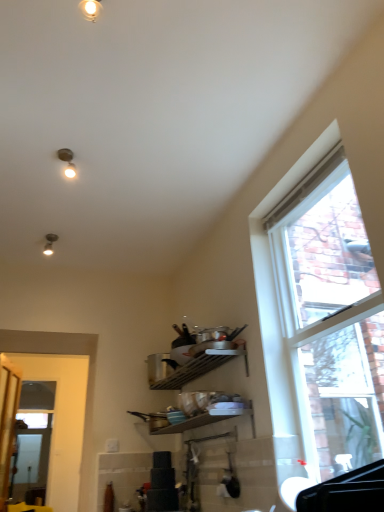
Question: Is matte silver light fixture at upper left, the 2th light fixture positioned from the right, not within white glossy door at left?

Choices:
 (A) no
 (B) yes

Answer: (B)

Question: Considering the relative sizes of matte silver light fixture at upper left, which is the second light fixture from front to back, and white glossy door at left in the image provided, is matte silver light fixture at upper left, which is the second light fixture from front to back, taller than white glossy door at left?

Choices:
 (A) no
 (B) yes

Answer: (A)

Question: Are matte silver light fixture at upper left, which ranks as the 1th light fixture in left-to-right order, and white glossy door at left far apart?

Choices:
 (A) yes
 (B) no

Answer: (A)

Question: Is matte silver light fixture at upper left, the 2th light fixture positioned from the right, to the right of white glossy door at left from the viewer's perspective?

Choices:
 (A) yes
 (B) no

Answer: (A)

Question: From the image's perspective, is matte silver light fixture at upper left, which is counted as the 2th light fixture, starting from the top, located above white glossy door at left?

Choices:
 (A) no
 (B) yes

Answer: (B)

Question: From a real-world perspective, is clear glass screen door at left physically located above or below matte white light fixture at upper center, which ranks as the 2th light fixture in left-to-right order?

Choices:
 (A) below
 (B) above

Answer: (A)

Question: In terms of height, does clear glass screen door at left look taller or shorter compared to matte white light fixture at upper center, which ranks as the 2th light fixture in left-to-right order?

Choices:
 (A) short
 (B) tall

Answer: (B)

Question: Is clear glass screen door at left in front of or behind matte white light fixture at upper center, acting as the first light fixture starting from the front, in the image?

Choices:
 (A) behind
 (B) front

Answer: (A)

Question: Is point 41,496 positioned closer to the camera than point 92,11?

Choices:
 (A) closer
 (B) farther

Answer: (B)

Question: Is matte white light fixture at upper center, which is the 1th light fixture from right to left, in front of or behind clear glass screen door at left in the image?

Choices:
 (A) behind
 (B) front

Answer: (B)

Question: Which is correct: matte white light fixture at upper center, which appears as the first light fixture when viewed from the top, is inside clear glass screen door at left, or outside of it?

Choices:
 (A) outside
 (B) inside

Answer: (A)

Question: From their relative heights in the image, would you say matte white light fixture at upper center, which ranks as the 2th light fixture in left-to-right order, is taller or shorter than clear glass screen door at left?

Choices:
 (A) short
 (B) tall

Answer: (A)

Question: From a real-world perspective, is matte white light fixture at upper center, which appears as the first light fixture when viewed from the top, above or below clear glass screen door at left?

Choices:
 (A) above
 (B) below

Answer: (A)

Question: Relative to matte white light fixture at upper center, arranged as the second light fixture when ordered from the bottom, is clear glass window at right in front or behind?

Choices:
 (A) front
 (B) behind

Answer: (A)

Question: Is point (379, 291) closer or farther from the camera than point (86, 8)?

Choices:
 (A) farther
 (B) closer

Answer: (A)